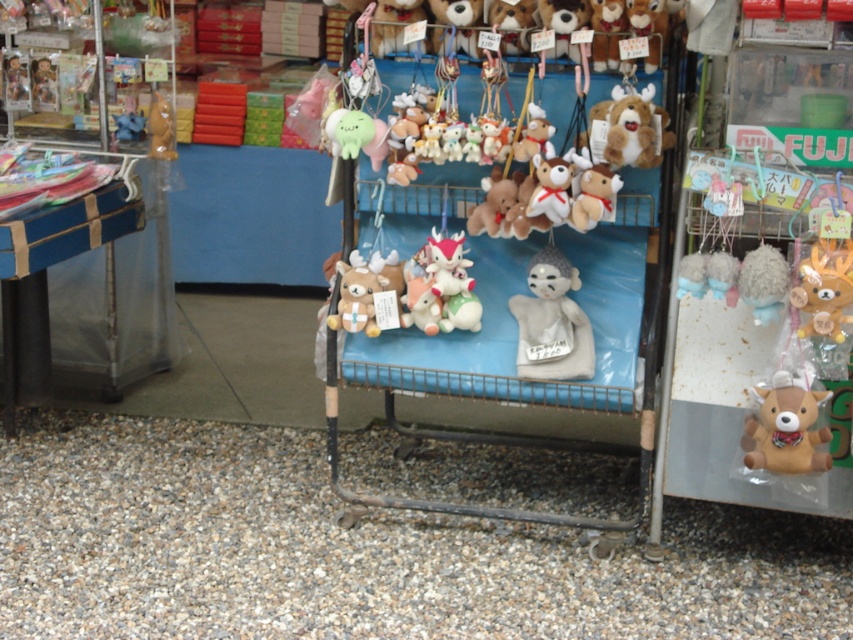
Is the position of velvet plush toys at center more distant than that of white fabric figurine at center?

No, it is in front of white fabric figurine at center.

Is point (422, 433) less distant than point (529, 264)?

No, it is not.

Is point (479, 438) more distant than point (543, 264)?

Yes, it is.

Where is `velvet plush toys at center`? velvet plush toys at center is located at coordinates (479, 349).

Can you confirm if brown plush deer at lower right is positioned to the right of matte brown bear at upper left?

Correct, you'll find brown plush deer at lower right to the right of matte brown bear at upper left.

This screenshot has width=853, height=640. What are the coordinates of `brown plush deer at lower right` in the screenshot? It's located at (785, 428).

This screenshot has height=640, width=853. What do you see at coordinates (824, 289) in the screenshot?
I see `brown plush toy at right` at bounding box center [824, 289].

Image resolution: width=853 pixels, height=640 pixels. What do you see at coordinates (824, 289) in the screenshot? I see `brown plush toy at right` at bounding box center [824, 289].

Identify the location of brown plush toy at right. The height and width of the screenshot is (640, 853). (824, 289).